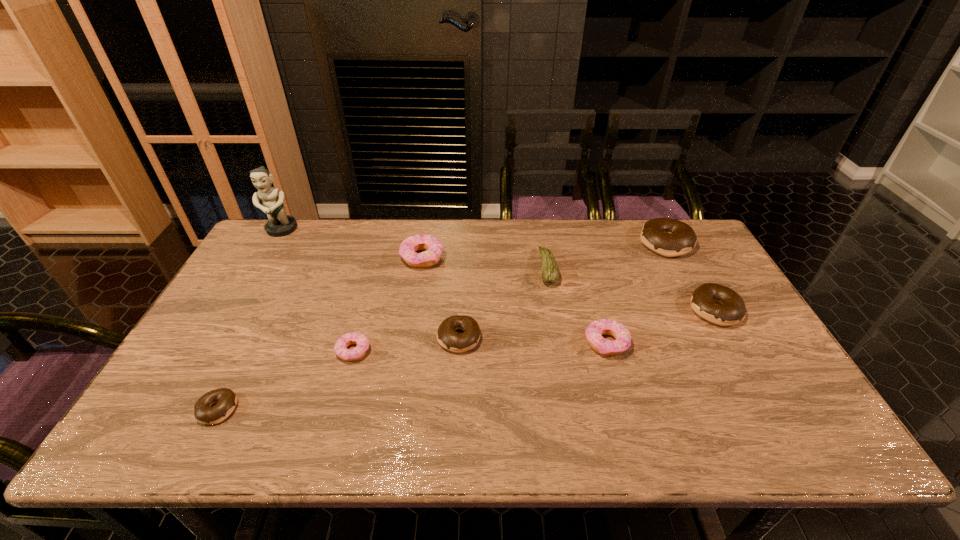
Locate an element on the screen. Image resolution: width=960 pixels, height=540 pixels. the closest object to the third smallest brown doughnut is located at coordinates [x=668, y=237].

The height and width of the screenshot is (540, 960). In order to click on doughnut identified as the fourth closest to the third brown doughnut from right to left in this screenshot , I will do [x=226, y=399].

Identify which doughnut is located as the nearest to the fifth doughnut from left to right. Please provide its 2D coordinates. Your answer should be formatted as a tuple, i.e. [(x, y)], where the tuple contains the x and y coordinates of a point satisfying the conditions above.

[(732, 311)]

In order to click on brown doughnut that is the second closest to the leftmost pink doughnut in this screenshot , I will do `click(226, 399)`.

Choose which brown doughnut is the nearest neighbor to the third smallest brown doughnut. Please provide its 2D coordinates. Your answer should be formatted as a tuple, i.e. [(x, y)], where the tuple contains the x and y coordinates of a point satisfying the conditions above.

[(668, 237)]

Select which pink doughnut appears as the closest to the smallest pink doughnut. Please provide its 2D coordinates. Your answer should be formatted as a tuple, i.e. [(x, y)], where the tuple contains the x and y coordinates of a point satisfying the conditions above.

[(434, 247)]

At what (x,y) coordinates should I click in order to perform the action: click on the closest pink doughnut relative to the second doughnut from left to right. Please return your answer as a coordinate pair (x, y). Looking at the image, I should click on (434, 247).

Find the location of a particular element. vacant space that satisfies the following two spatial constraints: 1. on the front-facing side of the tallest object; 2. on the right side of the farthest brown doughnut is located at coordinates (274, 244).

Find the location of a particular element. free space that satisfies the following two spatial constraints: 1. on the front-facing side of the nearest object; 2. on the right side of the tallest object is located at coordinates (177, 409).

I want to click on blank space that satisfies the following two spatial constraints: 1. at the stem end of the zucchini; 2. on the back side of the rightmost pink doughnut, so click(561, 343).